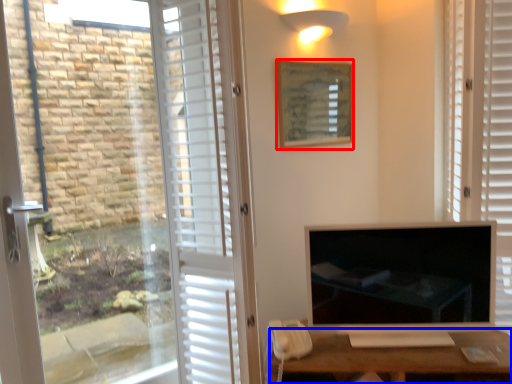
Question: Which object is further to the camera taking this photo, picture frame (highlighted by a red box) or desk (highlighted by a blue box)?

Choices:
 (A) picture frame
 (B) desk

Answer: (A)